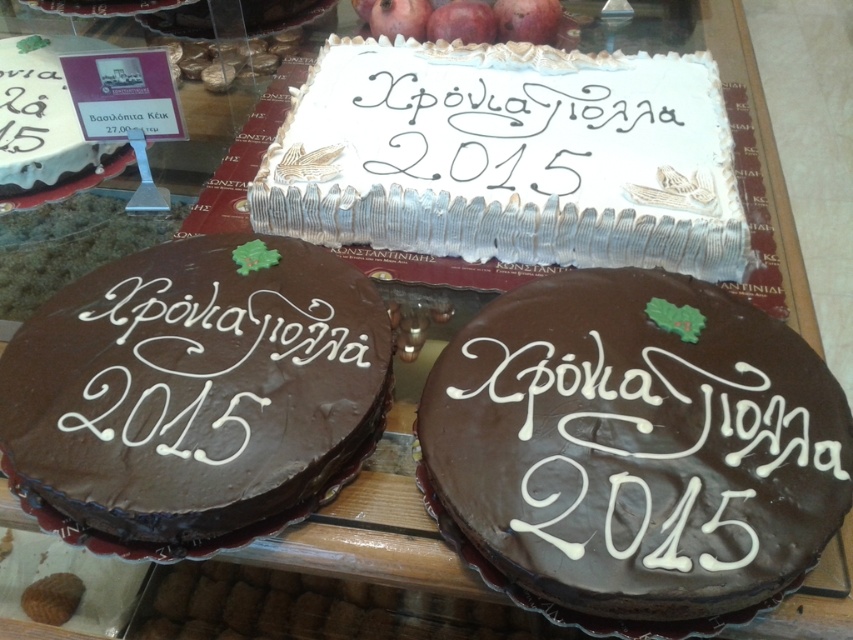
Question: Is chocolatesmoothcake at center to the left of white cream cake at center from the viewer's perspective?

Choices:
 (A) no
 (B) yes

Answer: (B)

Question: Which point is closer to the camera?

Choices:
 (A) white calligraphy at center
 (B) chocolatesmoothcake at lower center
 (C) chocolatesmoothcake at center

Answer: (B)

Question: Which is nearer to the chocolatesmoothcake at lower left?

Choices:
 (A) white matte cake at upper left
 (B) white cream cake at center

Answer: (B)

Question: Can you confirm if chocolatesmoothcake at lower center is positioned below chocolatesmoothcake at lower left?

Choices:
 (A) yes
 (B) no

Answer: (A)

Question: Which point is farther from the camera taking this photo?

Choices:
 (A) (666, 550)
 (B) (0, 112)
 (C) (238, 362)

Answer: (B)

Question: Can you confirm if chocolatesmoothcake at lower left is positioned above white calligraphy at center?

Choices:
 (A) yes
 (B) no

Answer: (B)